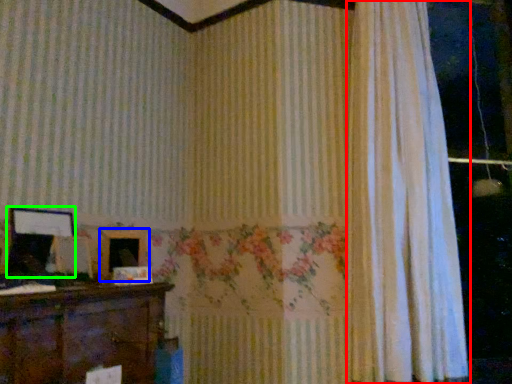
Question: Considering the real-world distances, which object is farthest from curtain (highlighted by a red box)? picture frame (highlighted by a blue box) or picture frame (highlighted by a green box)?

Choices:
 (A) picture frame
 (B) picture frame

Answer: (B)